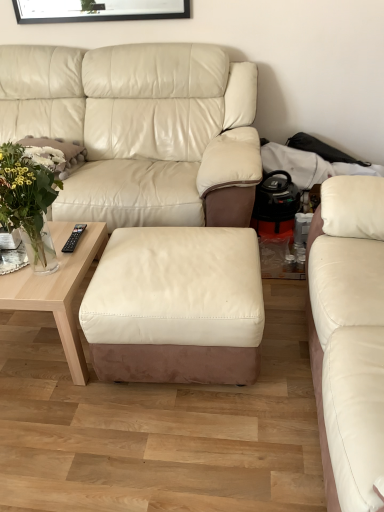
The image size is (384, 512). I want to click on vacant region under light wood coffee table at lower left (from a real-world perspective), so click(x=30, y=339).